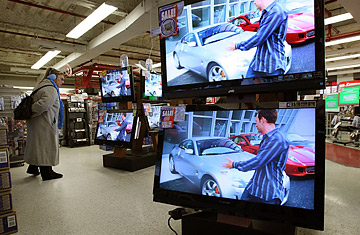
What are the coordinates of `floor` in the screenshot? It's located at (126, 196).